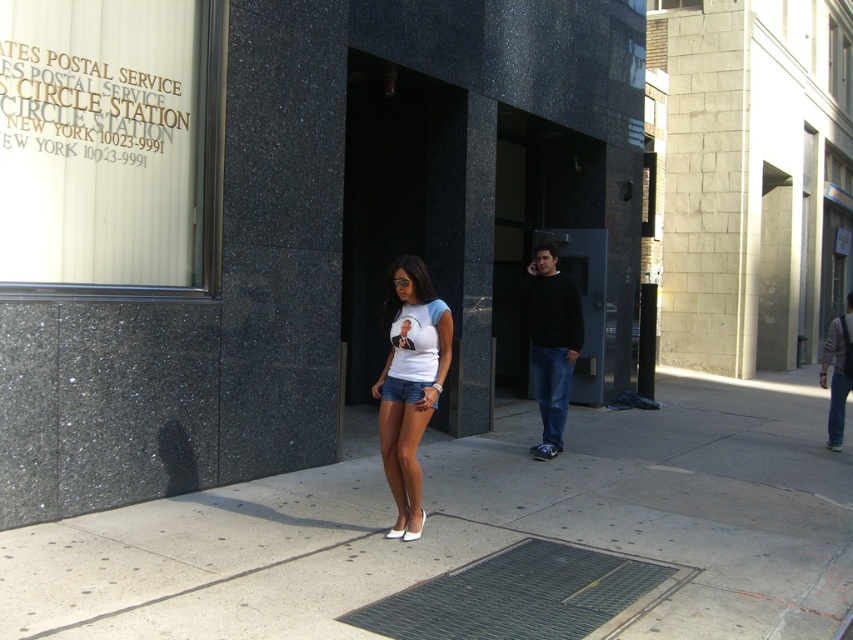
Question: Can you confirm if black cotton sweater at center is positioned to the right of denim shorts at center?

Choices:
 (A) yes
 (B) no

Answer: (A)

Question: Based on their relative distances, which object is farther from the concrete sidewalk at center?

Choices:
 (A) white matte t-shirt at center
 (B) white matte shorts at center
 (C) denim shorts at center
 (D) denim jeans at right

Answer: (D)

Question: Which of these objects is positioned farthest from the black cotton sweater at center?

Choices:
 (A) concrete sidewalk at center
 (B) denim jeans at right
 (C) denim shorts at center

Answer: (B)

Question: Which point is farther from the camera taking this photo?

Choices:
 (A) pos(846,580)
 (B) pos(398,294)
 (C) pos(850,301)

Answer: (C)

Question: Does concrete sidewalk at center have a lesser width compared to denim shorts at center?

Choices:
 (A) yes
 (B) no

Answer: (B)

Question: Is white matte shorts at center further to the viewer compared to denim jeans at right?

Choices:
 (A) no
 (B) yes

Answer: (A)